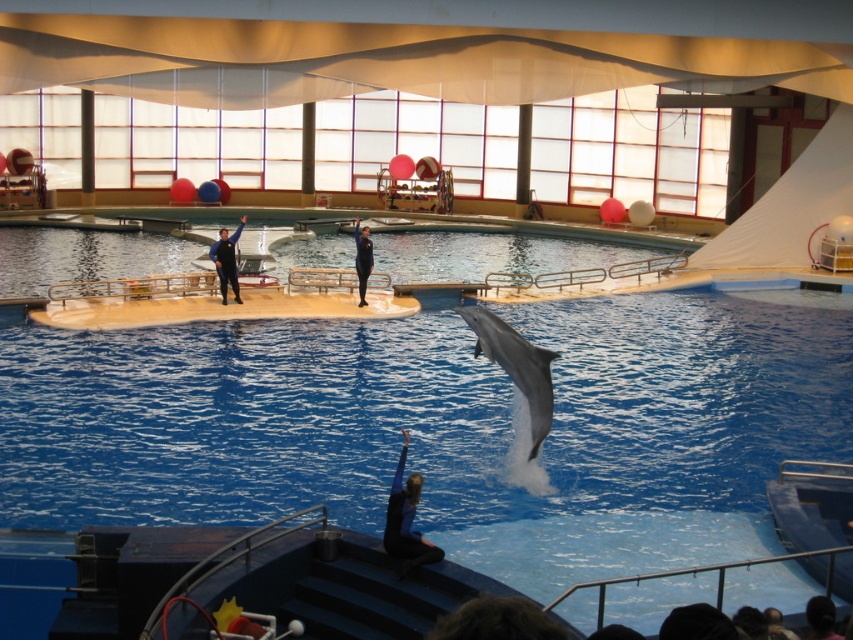
Question: Does gray smooth dolphin at center appear on the left side of blue matte wetsuit at center?

Choices:
 (A) no
 (B) yes

Answer: (A)

Question: Which of the following is the closest to the observer?

Choices:
 (A) black rubber wetsuit at center
 (B) black wetsuit at upper center
 (C) blue matte wetsuit at center
 (D) gray smooth dolphin at center

Answer: (C)

Question: Which of these objects is positioned closest to the black wetsuit at upper center?

Choices:
 (A) black rubber wetsuit at center
 (B) gray smooth dolphin at center
 (C) blue matte wetsuit at center

Answer: (A)

Question: Considering the relative positions of blue matte wetsuit at center and black wetsuit at upper center in the image provided, where is blue matte wetsuit at center located with respect to black wetsuit at upper center?

Choices:
 (A) right
 (B) left

Answer: (A)

Question: Does blue matte wetsuit at center appear under black rubber wetsuit at center?

Choices:
 (A) yes
 (B) no

Answer: (A)

Question: Which object is closer to the camera taking this photo?

Choices:
 (A) black rubber wetsuit at center
 (B) black wetsuit at upper center
 (C) blue matte wetsuit at center

Answer: (C)